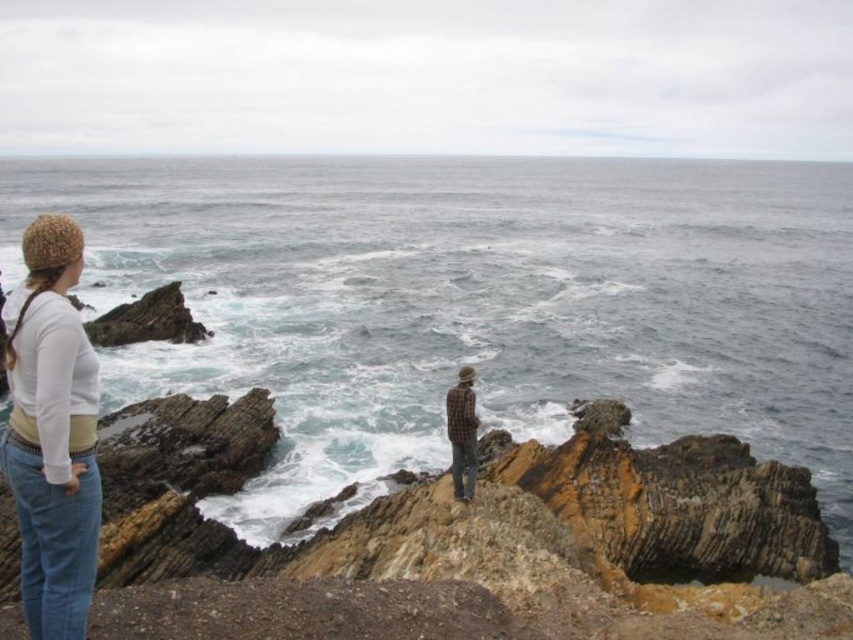
Question: Among these objects, which one is nearest to the camera?

Choices:
 (A) matte white sweater at left
 (B) dark blue water at center

Answer: (A)

Question: Which point appears farthest from the camera in this image?

Choices:
 (A) (80, 365)
 (B) (299, 412)

Answer: (B)

Question: Does dark blue water at center have a greater width compared to matte white sweater at left?

Choices:
 (A) yes
 (B) no

Answer: (A)

Question: Is dark blue water at center above matte white sweater at left?

Choices:
 (A) no
 (B) yes

Answer: (B)

Question: Observing the image, what is the correct spatial positioning of dark blue water at center in reference to matte white sweater at left?

Choices:
 (A) below
 (B) above

Answer: (B)